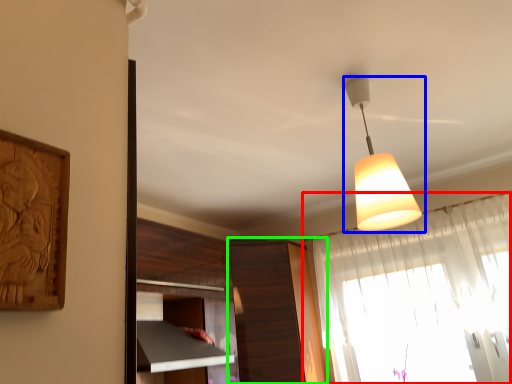
Question: Considering the real-world distances, which object is farthest from curtain (highlighted by a red box)? lamp (highlighted by a blue box) or cabinetry (highlighted by a green box)?

Choices:
 (A) lamp
 (B) cabinetry

Answer: (A)